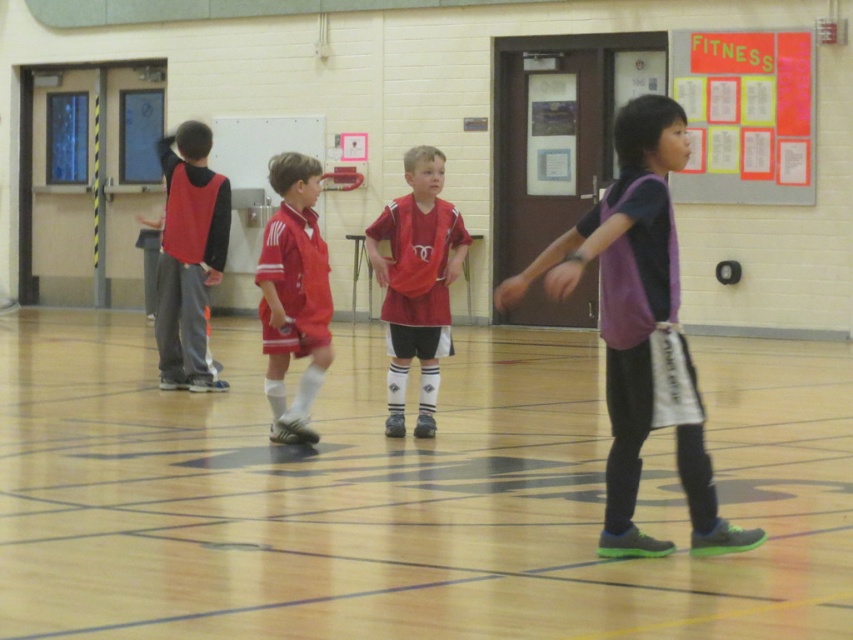
You are a coach observing the gymnasium. You need to locate the matte red jersey at center. Where exactly is it positioned in the gymnasium?

The matte red jersey at center is positioned at point 0.442 on the horizontal axis and 0.490 on the vertical axis within the gymnasium.

You are a photographer positioned at the back of the gymnasium and want to take a photo of both the matte red jersey at center and the matte red soccer uniform at center. Which one will appear larger in your photo?

The matte red jersey at center will appear larger in the photo because it is closer to the photographer than the matte red soccer uniform at center.